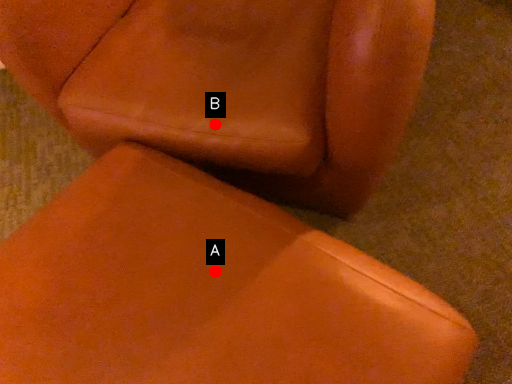
Question: Two points are circled on the image, labeled by A and B beside each circle. Which point is farther from the camera taking this photo?

Choices:
 (A) A is further
 (B) B is further

Answer: (B)